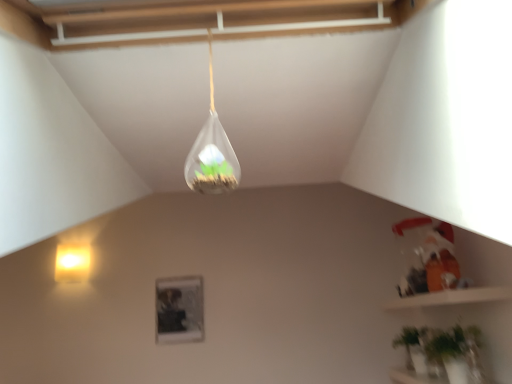
Question: Could you tell me if transparent glass terrarium at upper center, the 2th lamp when ordered from left to right, is turned towards green matte plant at lower right?

Choices:
 (A) no
 (B) yes

Answer: (A)

Question: Can you confirm if transparent glass terrarium at upper center, which is the 1th lamp in top-to-bottom order, is shorter than green matte plant at lower right?

Choices:
 (A) yes
 (B) no

Answer: (B)

Question: Considering the relative sizes of transparent glass terrarium at upper center, the first lamp from the front, and green matte plant at lower right in the image provided, is transparent glass terrarium at upper center, the first lamp from the front, bigger than green matte plant at lower right?

Choices:
 (A) yes
 (B) no

Answer: (B)

Question: Is transparent glass terrarium at upper center, the first lamp from the front, looking in the opposite direction of green matte plant at lower right?

Choices:
 (A) yes
 (B) no

Answer: (B)

Question: Considering the relative sizes of transparent glass terrarium at upper center, which is counted as the 2th lamp, starting from the back, and green matte plant at lower right in the image provided, is transparent glass terrarium at upper center, which is counted as the 2th lamp, starting from the back, wider than green matte plant at lower right?

Choices:
 (A) no
 (B) yes

Answer: (A)

Question: Is matte yellow wall sconce at left, which ranks as the first lamp in left-to-right order, wider or thinner than green matte plant at lower right?

Choices:
 (A) wide
 (B) thin

Answer: (B)

Question: Considering the positions of matte yellow wall sconce at left, acting as the 1th lamp starting from the back, and green matte plant at lower right in the image, is matte yellow wall sconce at left, acting as the 1th lamp starting from the back, taller or shorter than green matte plant at lower right?

Choices:
 (A) short
 (B) tall

Answer: (A)

Question: Considering the positions of matte yellow wall sconce at left, the 2th lamp in the right-to-left sequence, and green matte plant at lower right in the image, is matte yellow wall sconce at left, the 2th lamp in the right-to-left sequence, bigger or smaller than green matte plant at lower right?

Choices:
 (A) big
 (B) small

Answer: (B)

Question: Considering their positions, is matte yellow wall sconce at left, which is the second lamp in top-to-bottom order, located in front of or behind green matte plant at lower right?

Choices:
 (A) front
 (B) behind

Answer: (B)

Question: Is transparent glass terrarium at upper center, which is the 1th lamp in top-to-bottom order, to the left or to the right of green matte plant at lower right in the image?

Choices:
 (A) left
 (B) right

Answer: (A)

Question: Is transparent glass terrarium at upper center, which is counted as the 2th lamp, starting from the back, taller or shorter than green matte plant at lower right?

Choices:
 (A) short
 (B) tall

Answer: (B)

Question: From the image's perspective, is transparent glass terrarium at upper center, the 1th lamp from the right, located above or below green matte plant at lower right?

Choices:
 (A) below
 (B) above

Answer: (B)

Question: Would you say transparent glass terrarium at upper center, the 2th lamp when ordered from left to right, is inside or outside green matte plant at lower right?

Choices:
 (A) outside
 (B) inside

Answer: (A)

Question: Based on their positions, is green matte plant at lower right located to the left or right of matte yellow wall sconce at left, acting as the 1th lamp starting from the back?

Choices:
 (A) left
 (B) right

Answer: (B)

Question: Relative to matte yellow wall sconce at left, which ranks as the first lamp in left-to-right order, is green matte plant at lower right in front or behind?

Choices:
 (A) front
 (B) behind

Answer: (A)